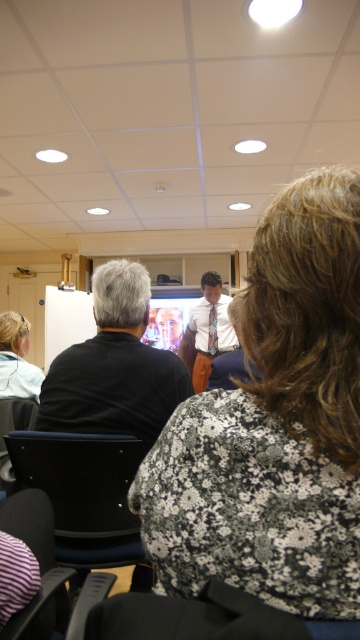
Question: Does striped fabric chair at lower left appear under white shirt with tie at center?

Choices:
 (A) no
 (B) yes

Answer: (B)

Question: Is black leather chair at lower left bigger than white shirt with tie at center?

Choices:
 (A) yes
 (B) no

Answer: (B)

Question: Observing the image, what is the correct spatial positioning of black matte laptop at center in reference to black leather chair at lower left?

Choices:
 (A) below
 (B) above

Answer: (B)

Question: Which point appears closest to the camera in this image?

Choices:
 (A) (41, 589)
 (B) (198, 369)
 (C) (340, 324)
 (D) (87, 497)

Answer: (C)

Question: Which object appears farthest from the camera in this image?

Choices:
 (A) black leather chair at lower left
 (B) blonde hair at lower left
 (C) striped fabric chair at lower left

Answer: (B)

Question: Among these points, which one is nearest to the camera?

Choices:
 (A) (6, 346)
 (B) (201, 376)
 (C) (335, 616)
 (D) (61, 584)

Answer: (C)